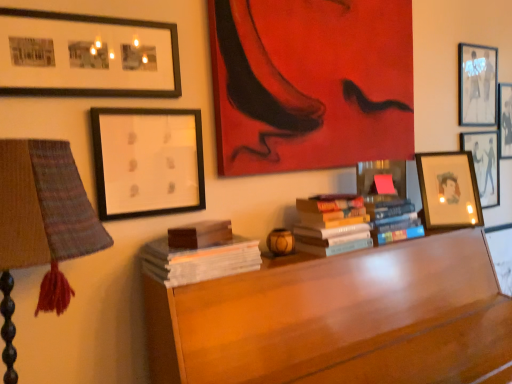
Find the location of a particular element. empty space that is ontop of hardcover books at center, arranged as the fourth book when viewed from the left is located at coordinates (386, 191).